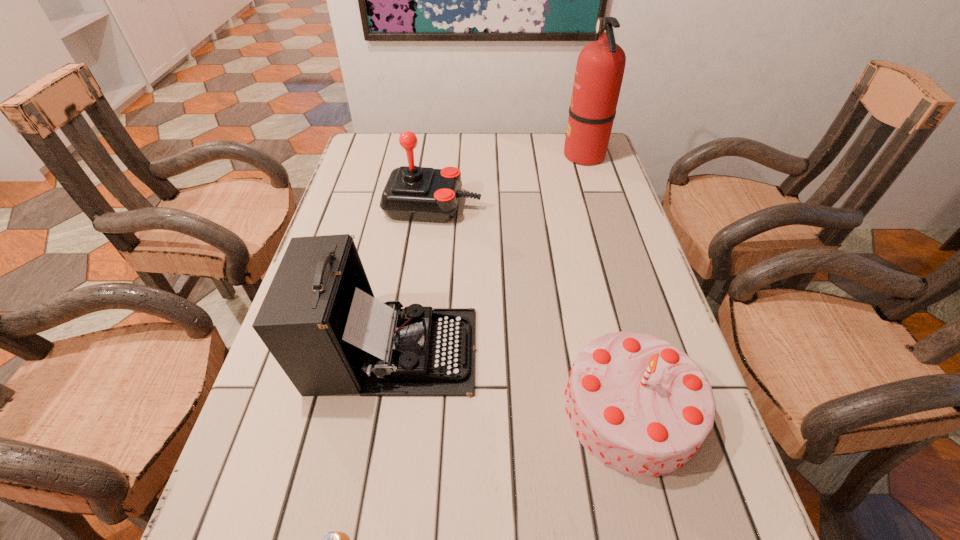
Find the location of `free space at the far right corner`. free space at the far right corner is located at coordinates (557, 135).

You are a GUI agent. You are given a task and a screenshot of the screen. Output one action in this format:
    pyautogui.click(x=<x>, y=<y>)
    Task: Click on the free space between the typewriter and the joystick
    The height and width of the screenshot is (540, 960).
    Given the screenshot: What is the action you would take?
    pyautogui.click(x=413, y=278)

Find the location of a particular element. The width and height of the screenshot is (960, 540). unoccupied area between the typewriter and the joystick is located at coordinates tap(413, 278).

Identify the location of vacant area that lies between the joystick and the birthday cake. (532, 308).

At what (x,y) coordinates should I click in order to perform the action: click on unoccupied area between the farthest object and the typewriter. Please return your answer as a coordinate pair (x, y). This screenshot has width=960, height=540. Looking at the image, I should click on (488, 253).

The image size is (960, 540). What are the coordinates of `vacant area that lies between the fourth tallest object and the fourth nearest object` in the screenshot? It's located at (532, 308).

Find the location of a particular element. This screenshot has width=960, height=540. vacant point located between the second shortest object and the fourth nearest object is located at coordinates (532, 308).

Image resolution: width=960 pixels, height=540 pixels. In order to click on vacant area that lies between the second shortest object and the tallest object in this screenshot , I will do `click(608, 282)`.

Locate an element on the screen. object identified as the closest to the fourth nearest object is located at coordinates (600, 67).

The height and width of the screenshot is (540, 960). Identify the location of object that stands as the third closest to the second shortest object. [x=411, y=193].